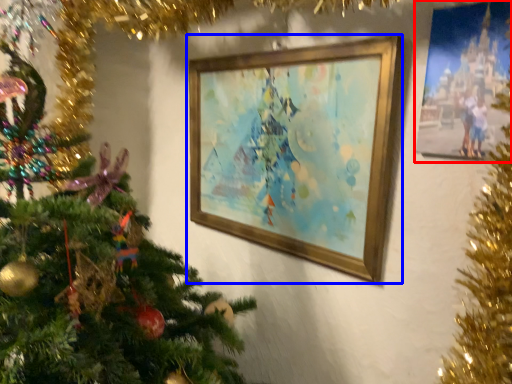
Question: Which point is closer to the camera, picture frame (highlighted by a red box) or picture frame (highlighted by a blue box)?

Choices:
 (A) picture frame
 (B) picture frame

Answer: (A)